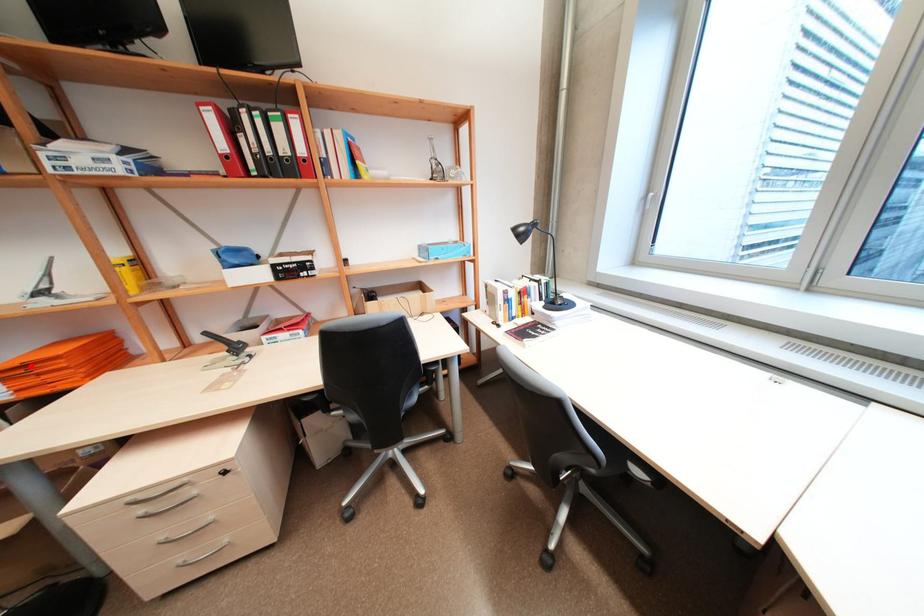
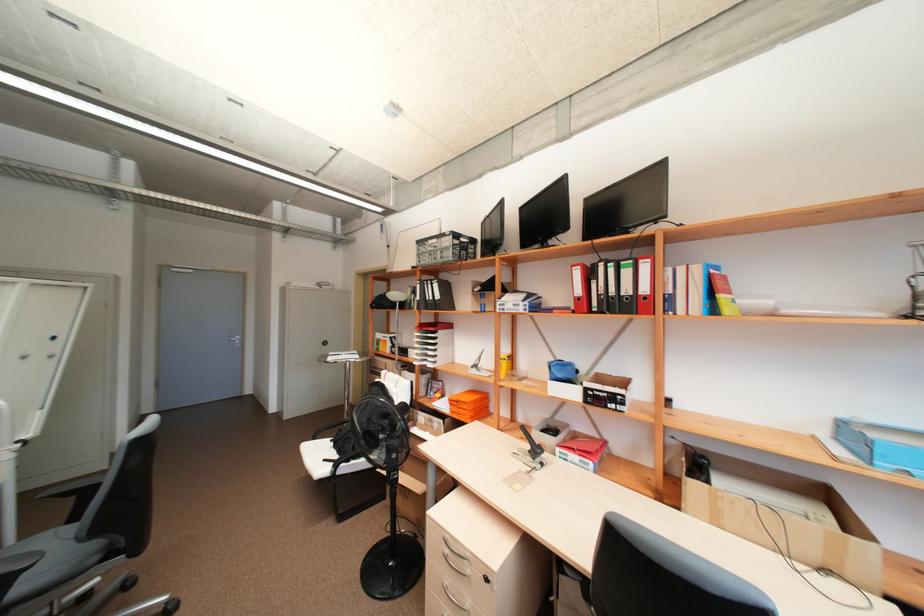
In the second image, find the point that corresponds to the highlighted location in the first image.

(463, 400)